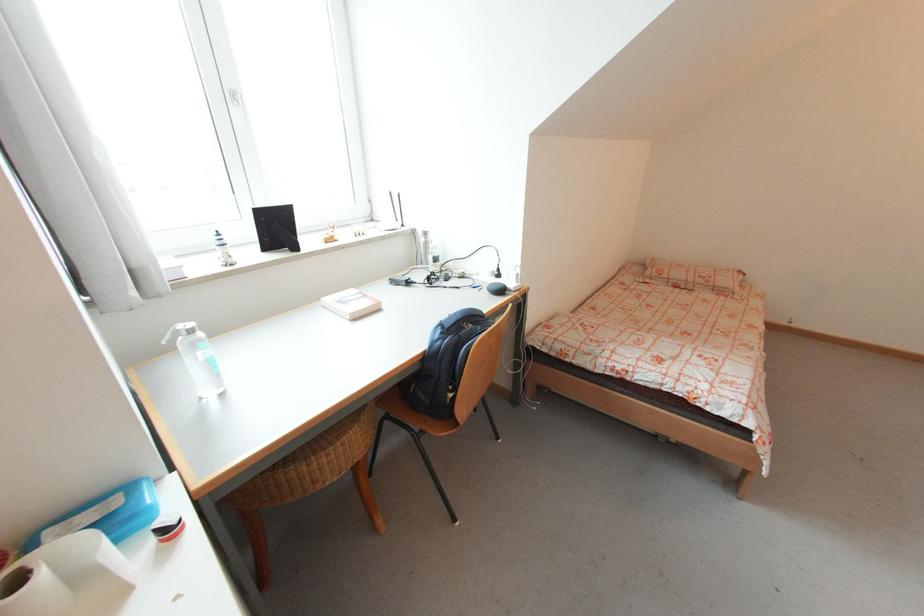
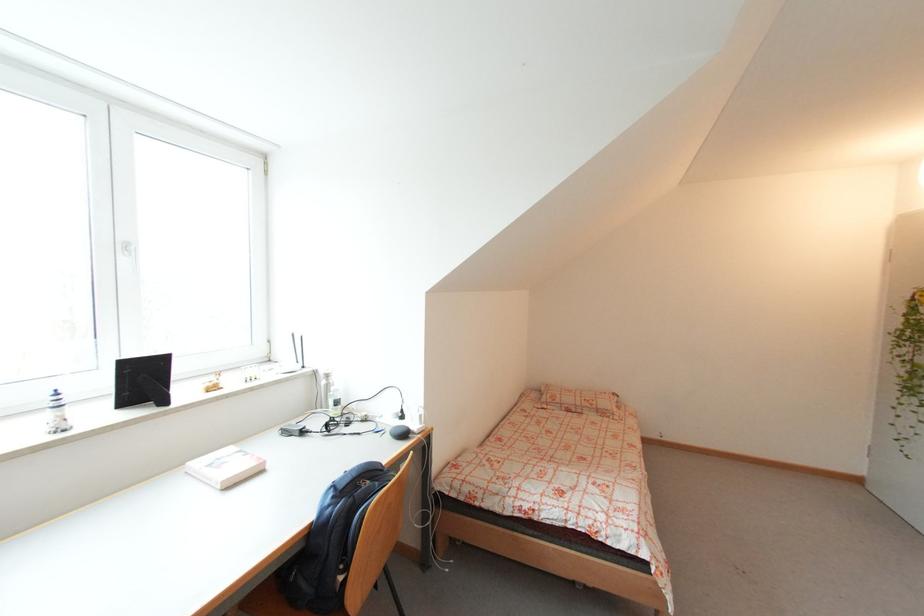
Where in the second image is the point corresponding to point (492, 291) from the first image?

(395, 435)